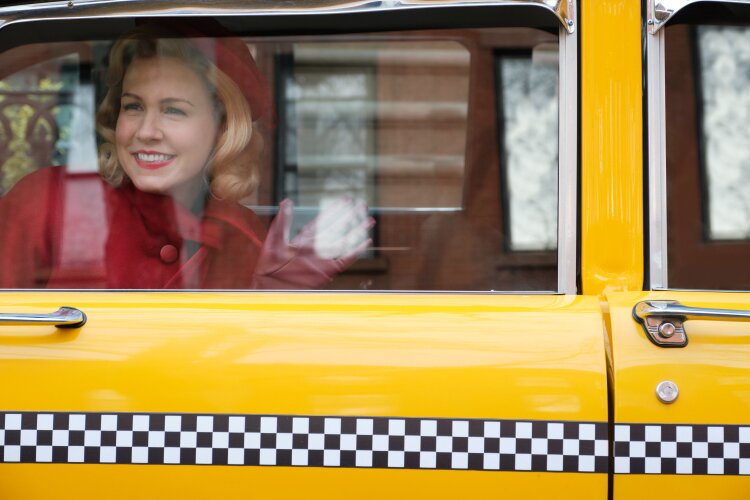
Find the location of a particular element. This screenshot has height=500, width=750. windows is located at coordinates (411, 124), (424, 182), (40, 121), (717, 142).